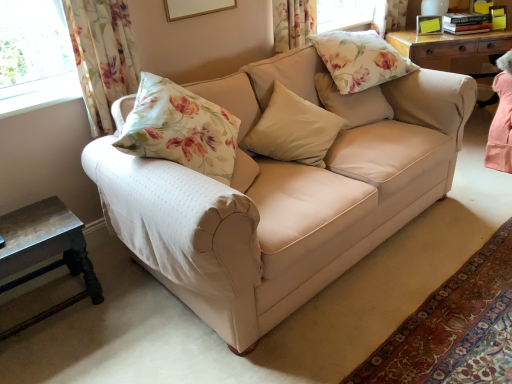
Question: From a real-world perspective, is rustic wood side table at lower left physically located above or below beige fabric couch at center?

Choices:
 (A) above
 (B) below

Answer: (B)

Question: In the image, is rustic wood side table at lower left positioned in front of or behind beige fabric couch at center?

Choices:
 (A) front
 (B) behind

Answer: (B)

Question: Which is farther from the beige fabric pillow at center, arranged as the first pillow when ordered from the bottom?

Choices:
 (A) rustic wood side table at lower left
 (B) beige fabric couch at center
 (C) floral fabric pillow at upper right, which is the second pillow in top-to-bottom order
 (D) floral fabric pillow at upper center, the first pillow viewed from the top
 (E) floral fabric curtain at upper left

Answer: (A)

Question: Which of these objects is positioned farthest from the rustic wood side table at lower left?

Choices:
 (A) beige fabric couch at center
 (B) beige fabric pillow at center, arranged as the first pillow when ordered from the bottom
 (C) floral fabric pillow at upper center, placed as the third pillow when sorted from bottom to top
 (D) floral fabric curtain at upper left
 (E) floral fabric pillow at upper right, which is the second pillow in top-to-bottom order

Answer: (C)